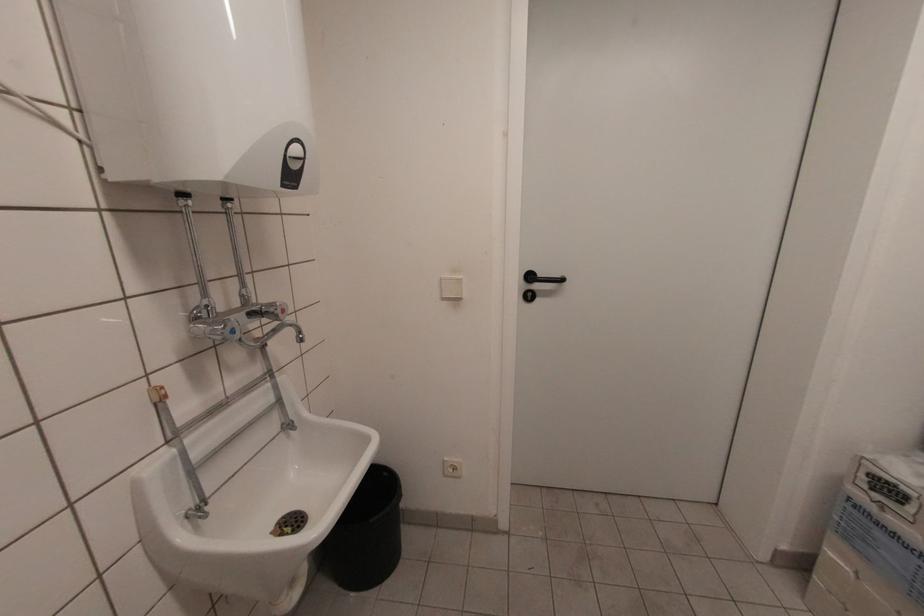
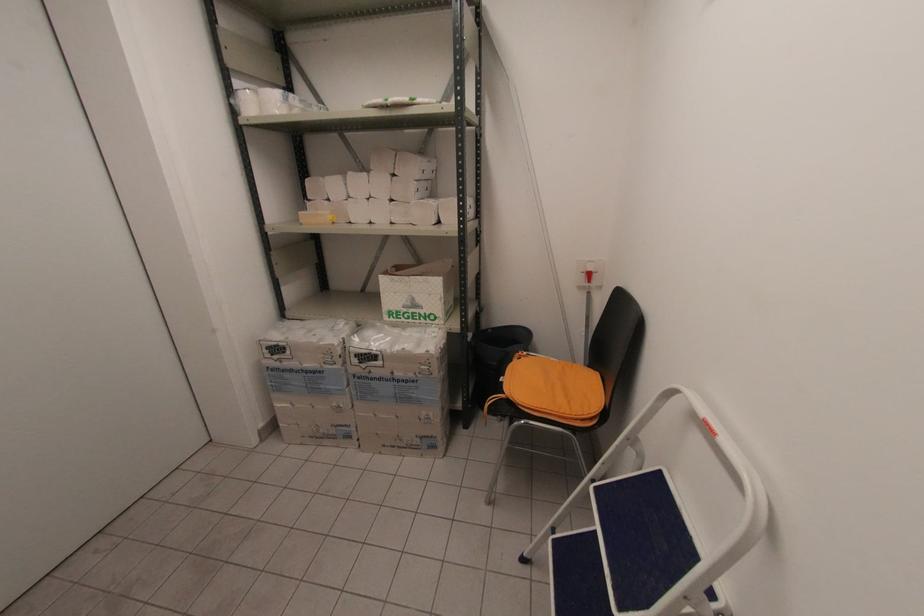
Consider the image. Based on the continuous images, in which direction is the camera rotating?

The camera's rotation is toward right-down.